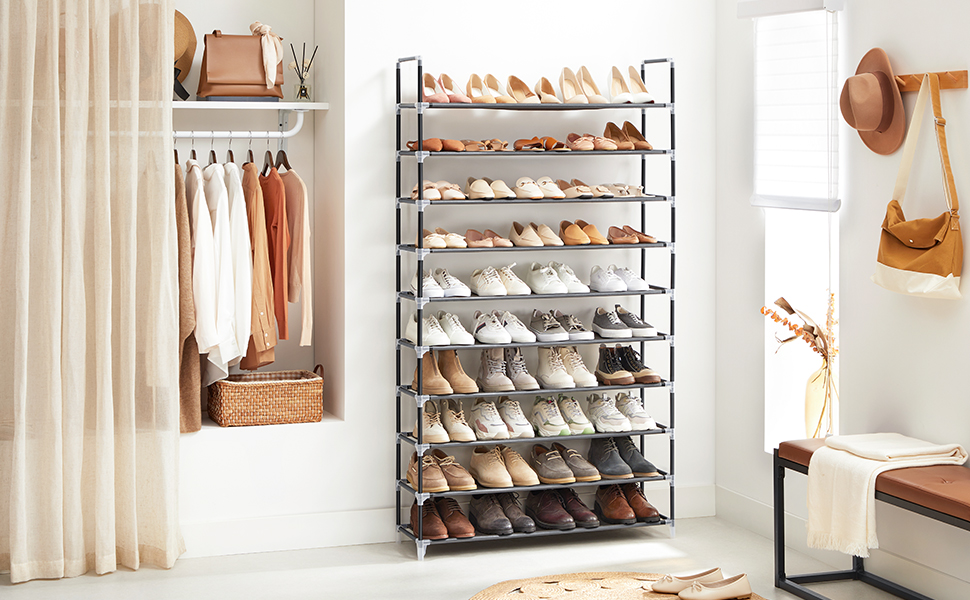
At what (x,y) coordinates should I click in order to perform the action: click on 5th shelf of shoe rack. Please return your answer as a coordinate pair (x, y). The width and height of the screenshot is (970, 600). Looking at the image, I should click on (434, 285), (455, 286), (490, 281), (514, 280), (547, 280), (572, 278), (605, 280), (630, 273).